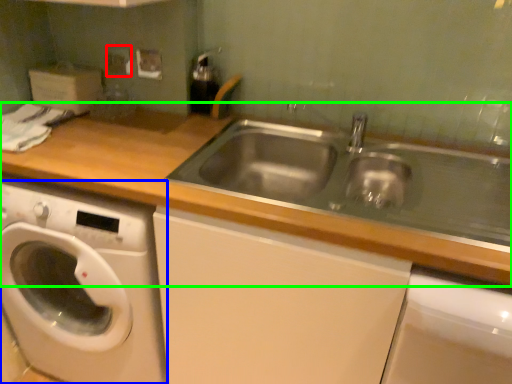
Question: Which object is the farthest from electric outlet (highlighted by a red box)? Choose among these: washing machine (highlighted by a blue box) or countertop (highlighted by a green box).

Choices:
 (A) washing machine
 (B) countertop

Answer: (A)